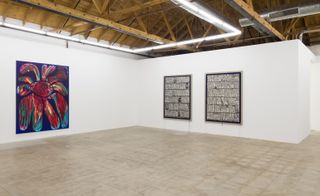
This screenshot has width=320, height=196. I want to click on paintings, so click(x=39, y=94), click(x=176, y=95), click(x=222, y=95).